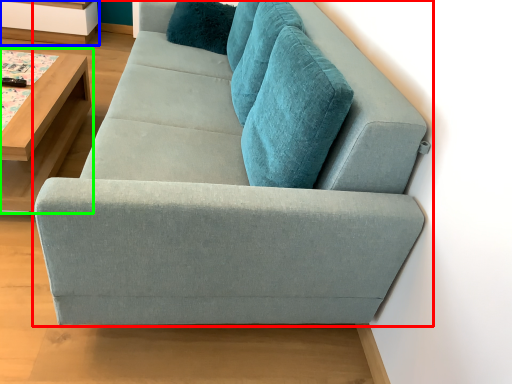
Question: Which object is the closest to the studio couch (highlighted by a red box)? Choose among these: shelf (highlighted by a blue box) or table (highlighted by a green box).

Choices:
 (A) shelf
 (B) table

Answer: (B)